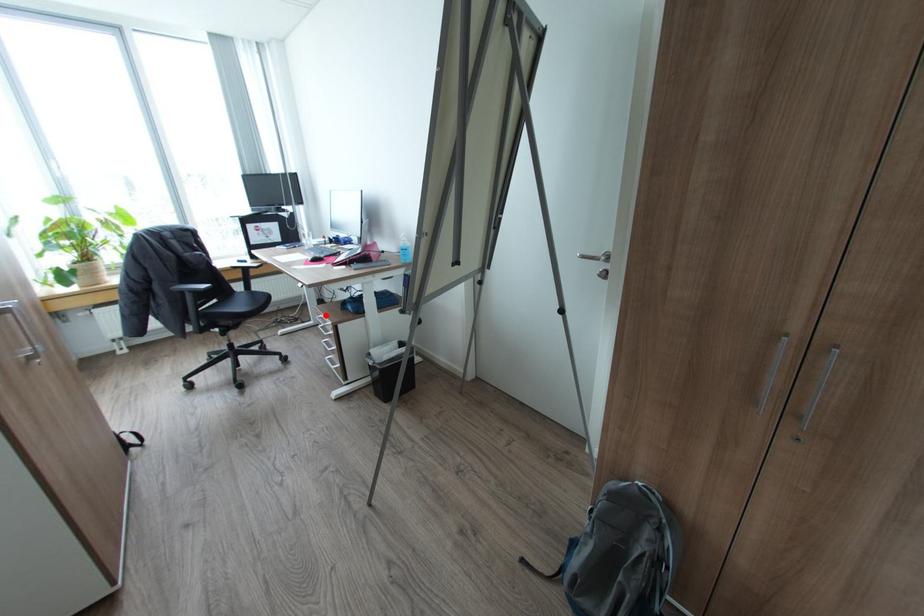
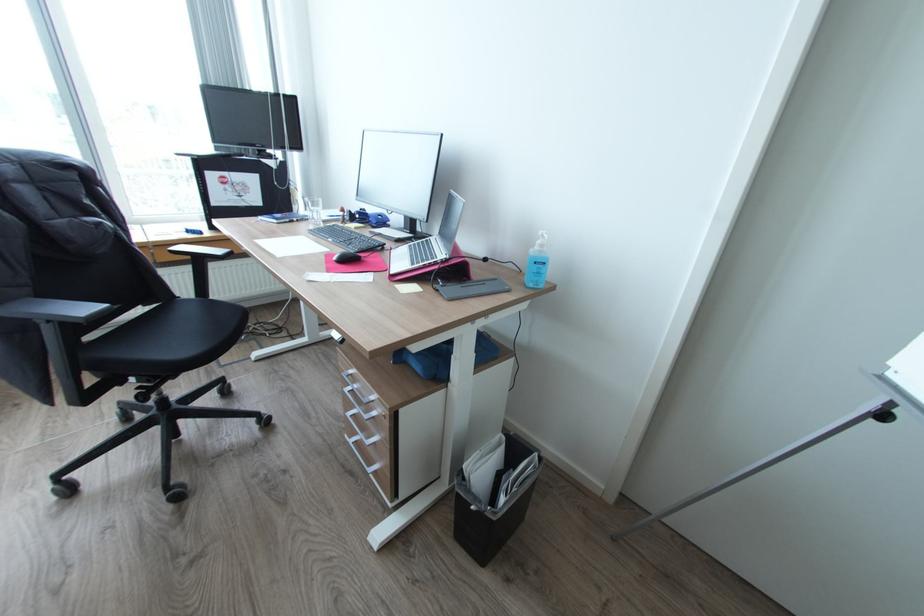
Question: I am providing you with two images of the same scene from different viewpoints. Image1 has a red point marked. In image2, the corresponding 3D location appears at what relative position? Reply with the corresponding letter.

Choices:
 (A) Closer
 (B) Farther

Answer: (B)